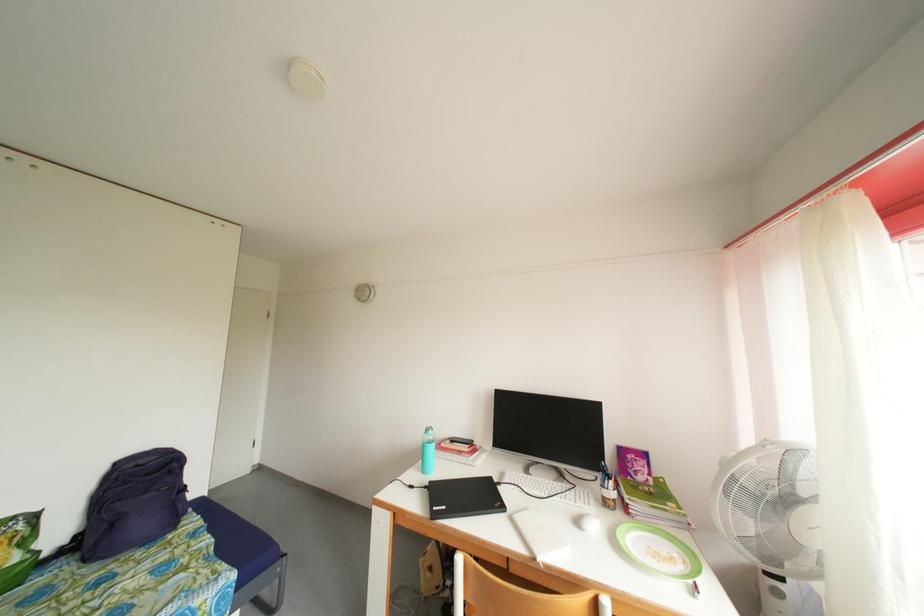
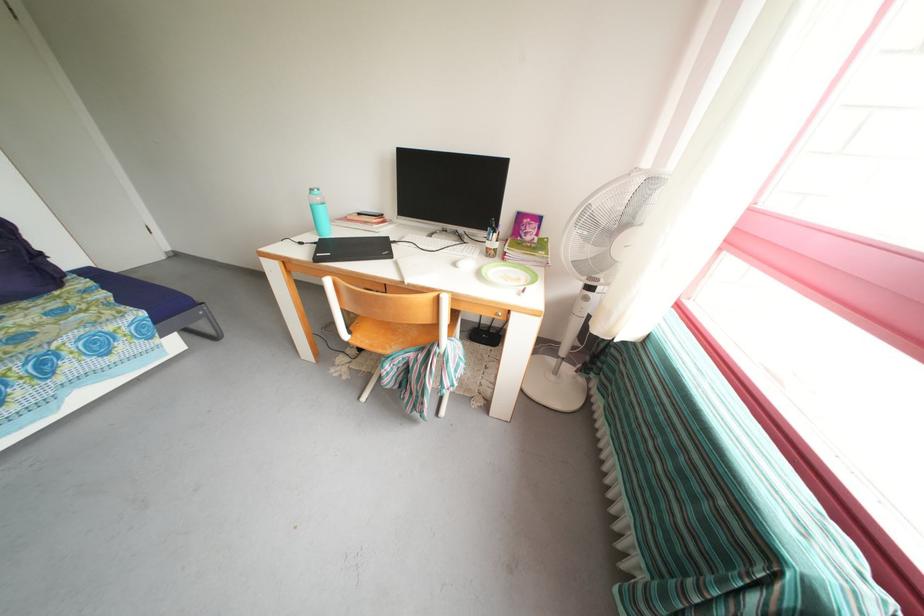
Where in the second image is the point corresponding to point (434, 436) from the first image?

(319, 196)